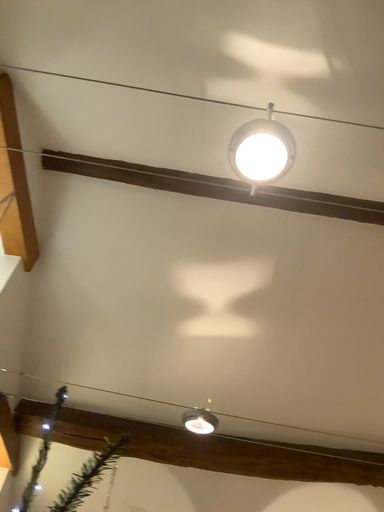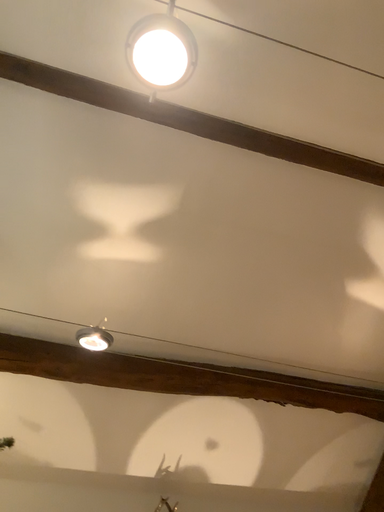
Question: Which way did the camera rotate in the video?

Choices:
 (A) rotated right
 (B) rotated left

Answer: (A)